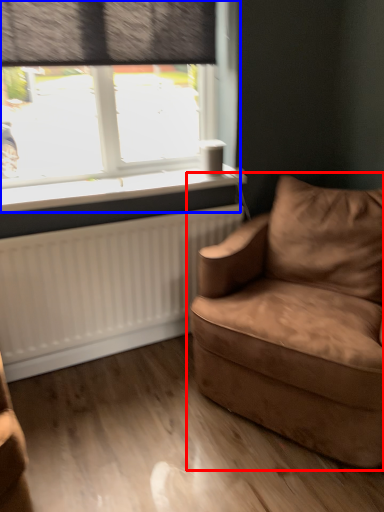
Question: Which object is closer to the camera taking this photo, studio couch (highlighted by a red box) or window (highlighted by a blue box)?

Choices:
 (A) studio couch
 (B) window

Answer: (A)